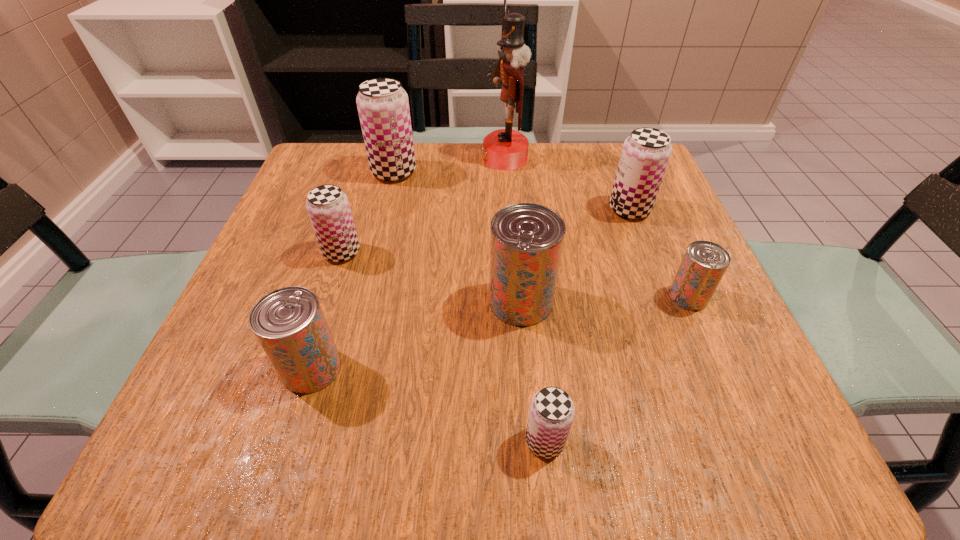
I want to click on vacant region between the farthest beer can and the seventh farthest object, so click(x=352, y=270).

Locate an element on the screen. free spot between the sixth nearest object and the rightmost red beer can is located at coordinates (659, 253).

Image resolution: width=960 pixels, height=540 pixels. Identify the location of object that can be found as the second closest to the second smallest purple beer can. (383, 106).

Locate which object ranks fifth in proximity to the biggest red beer can. Please provide its 2D coordinates. Your answer should be formatted as a tuple, i.e. [(x, y)], where the tuple contains the x and y coordinates of a point satisfying the conditions above.

[(328, 207)]

Find the location of a particular element. Image resolution: width=960 pixels, height=540 pixels. beer can that is the second closest to the second farthest purple beer can is located at coordinates (526, 241).

The width and height of the screenshot is (960, 540). Identify the location of beer can that is the fifth nearest to the second nearest object. (704, 264).

Find the location of a particular element. The width and height of the screenshot is (960, 540). purple beer can that is the second closest to the smallest purple beer can is located at coordinates (646, 152).

You are a GUI agent. You are given a task and a screenshot of the screen. Output one action in this format:
    pyautogui.click(x=<x>, y=<y>)
    Task: Click on the purple beer can identified as the closest to the nearest beer can
    The width and height of the screenshot is (960, 540).
    Given the screenshot: What is the action you would take?
    pyautogui.click(x=328, y=207)

Identify the location of red beer can that stands as the second closest to the rightmost red beer can. (289, 323).

Find the location of `red beer can that is the closest one to the nutcracker`. red beer can that is the closest one to the nutcracker is located at coordinates (526, 241).